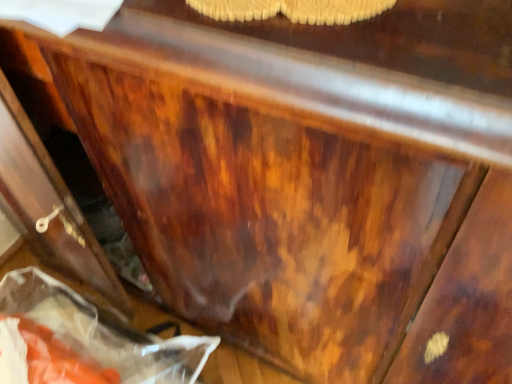
Question: Should I look upward or downward to see translucent plastic bag at lower left?

Choices:
 (A) down
 (B) up

Answer: (A)